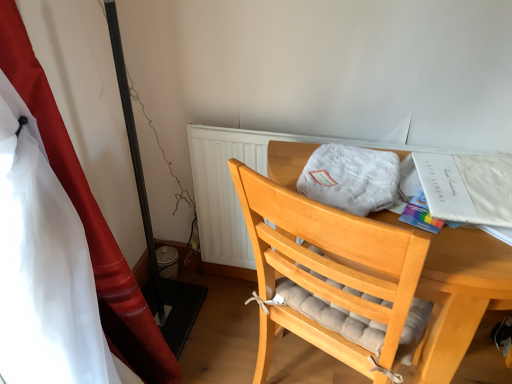
Question: Considering the positions of red satin curtain at left and white fluffy blanket at center in the image, is red satin curtain at left wider or thinner than white fluffy blanket at center?

Choices:
 (A) wide
 (B) thin

Answer: (B)

Question: Choose the correct answer: Is red satin curtain at left inside white fluffy blanket at center or outside it?

Choices:
 (A) outside
 (B) inside

Answer: (A)

Question: Estimate the real-world distances between objects in this image. Which object is closer to the white fluffy blanket at center?

Choices:
 (A) red satin curtain at left
 (B) white paper at upper right
 (C) light wood desk at center

Answer: (C)

Question: Considering the real-world distances, which object is farthest from the red satin curtain at left?

Choices:
 (A) light wood desk at center
 (B) white fluffy blanket at center
 (C) white paper at upper right

Answer: (C)